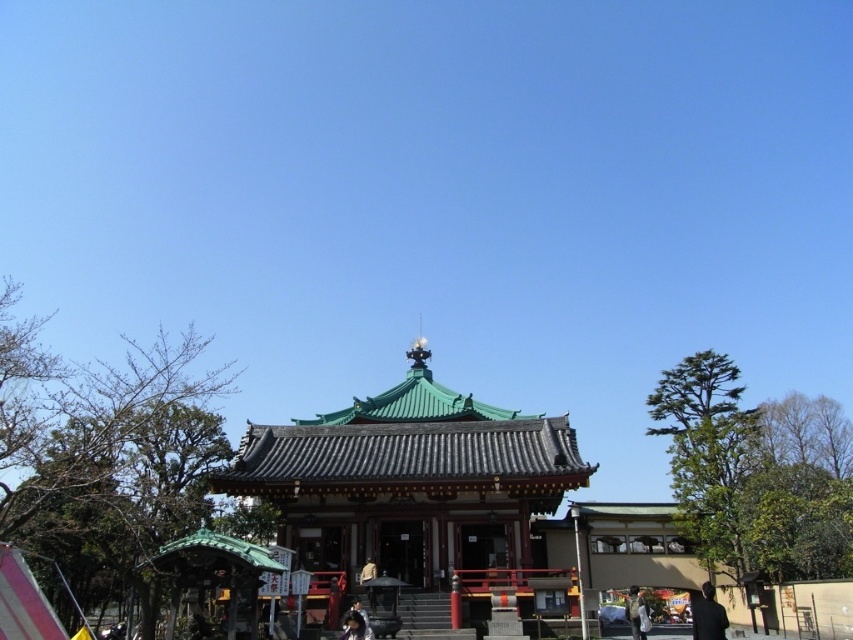
In the scene shown: Can you confirm if black fabric person at lower right is taller than camouflage fabric jacket at lower right?

Incorrect, black fabric person at lower right's height is not larger of camouflage fabric jacket at lower right's.

Is black fabric person at lower right smaller than camouflage fabric jacket at lower right?

Incorrect, black fabric person at lower right is not smaller in size than camouflage fabric jacket at lower right.

You are a GUI agent. You are given a task and a screenshot of the screen. Output one action in this format:
    pyautogui.click(x=<x>, y=<y>)
    Task: Click on the black fabric person at lower right
    
    Given the screenshot: What is the action you would take?
    pyautogui.click(x=708, y=616)

Describe the element at coordinates (409, 481) in the screenshot. Image resolution: width=853 pixels, height=640 pixels. I see `green tile roof pagoda at center` at that location.

Between green tile roof pagoda at center and black fabric person at lower right, which one has less height?

black fabric person at lower right is shorter.

Between point (509, 506) and point (717, 614), which one is positioned behind?

The point (509, 506) is more distant.

The height and width of the screenshot is (640, 853). I want to click on green tile roof pagoda at center, so click(x=409, y=481).

Between green tile roof pagoda at center and camouflage fabric jacket at lower right, which one is positioned higher?

green tile roof pagoda at center

Based on the photo, can you confirm if green tile roof pagoda at center is positioned below camouflage fabric jacket at lower right?

No, green tile roof pagoda at center is not below camouflage fabric jacket at lower right.

Where is `green tile roof pagoda at center`? green tile roof pagoda at center is located at coordinates (409, 481).